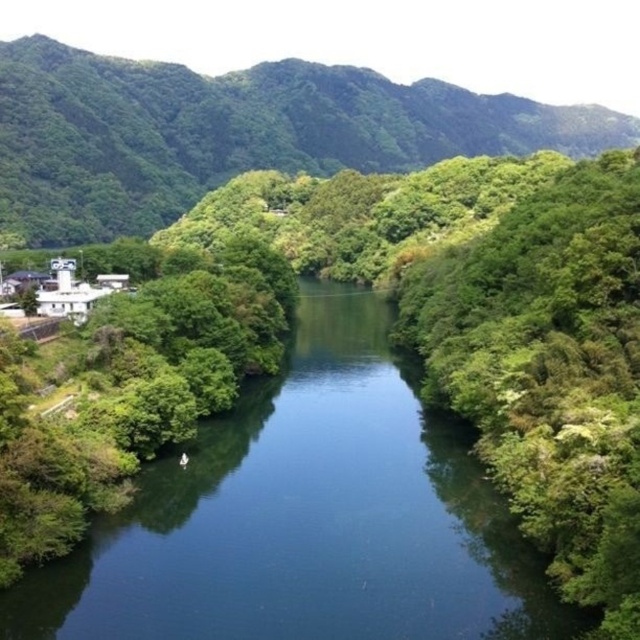
Is blue smooth water at center shorter than green leafy mountain at upper left?

Yes, blue smooth water at center is shorter than green leafy mountain at upper left.

Does point (497, 560) come behind point (570, 108)?

No, it is in front of (570, 108).

Which is behind, point (381, 525) or point (84, 182)?

The point (84, 182) is behind.

Where is `blue smooth water at center`? blue smooth water at center is located at coordinates (307, 516).